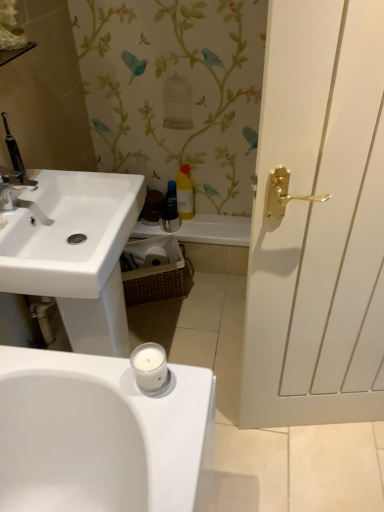
Identify the location of vacant region to the right of brown woven basket at center. The width and height of the screenshot is (384, 512). (210, 294).